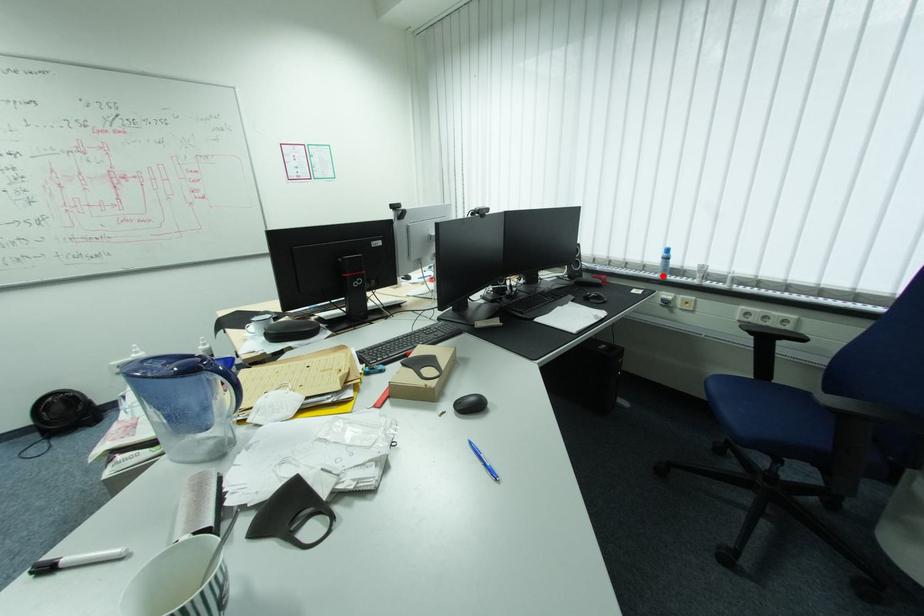
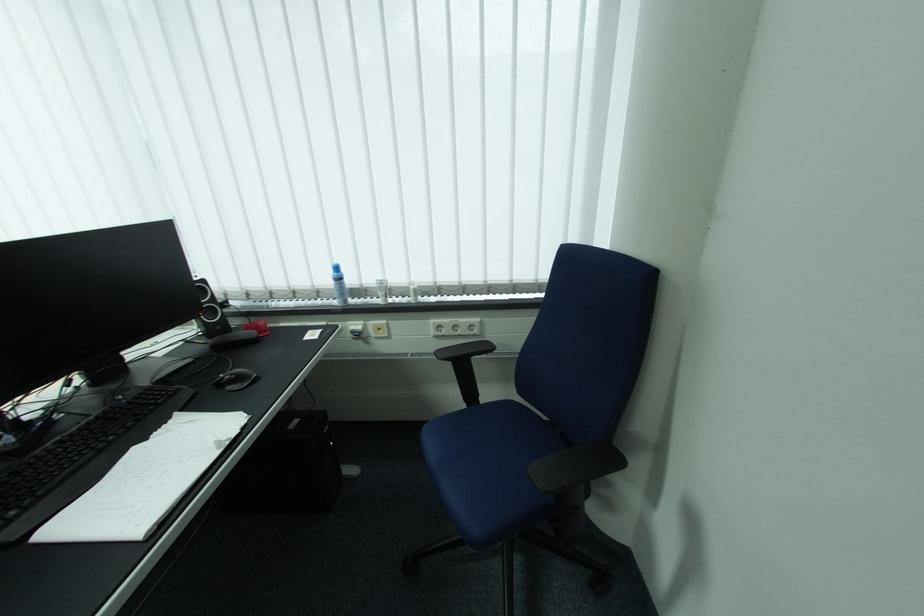
Where in the second image is the point corresponding to the highlighted location from the first image?

(342, 302)